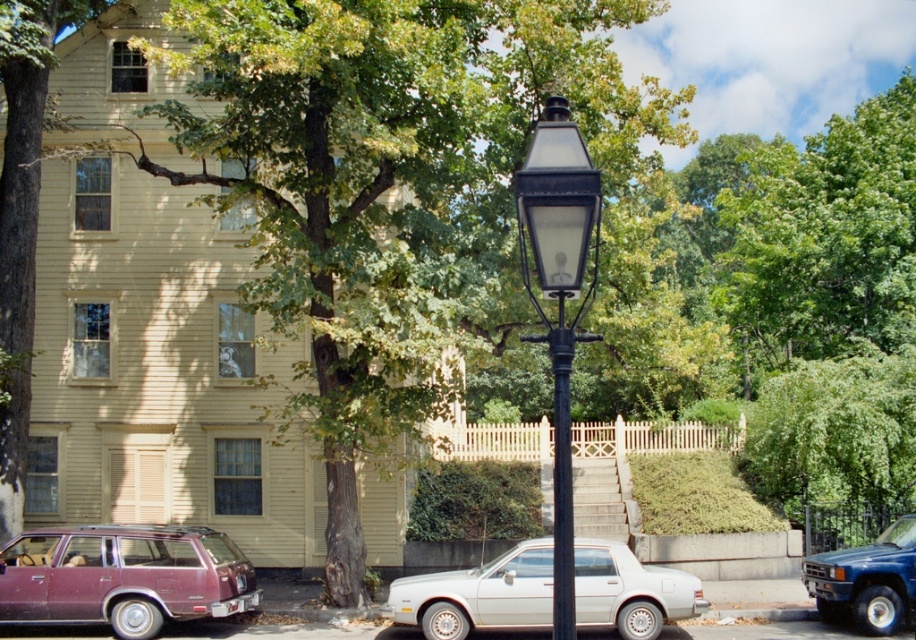
Question: Which point is closer to the camera?

Choices:
 (A) coord(558,378)
 (B) coord(397,582)
 (C) coord(237,115)
 (D) coord(570,477)

Answer: (A)

Question: Which object appears farthest from the camera in this image?

Choices:
 (A) black metal streetlight at center
 (B) maroon matte station wagon at lower left
 (C) blue metallic suv at lower right

Answer: (C)

Question: Does maroon matte station wagon at lower left have a smaller size compared to blue metallic suv at lower right?

Choices:
 (A) yes
 (B) no

Answer: (B)

Question: Is white matte sedan at center smaller than blue metallic suv at lower right?

Choices:
 (A) yes
 (B) no

Answer: (A)

Question: Is green leafy tree at center positioned in front of white matte sedan at center?

Choices:
 (A) yes
 (B) no

Answer: (A)

Question: Which point appears closest to the camera in this image?

Choices:
 (A) (814, 564)
 (B) (552, 355)
 (C) (563, 579)

Answer: (C)